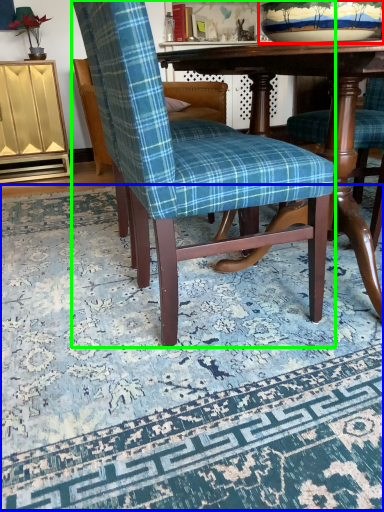
Question: Which object is positioned closest to bowl (highlighted by a red box)? Select from mat (highlighted by a blue box) and chair (highlighted by a green box).

Choices:
 (A) mat
 (B) chair

Answer: (B)